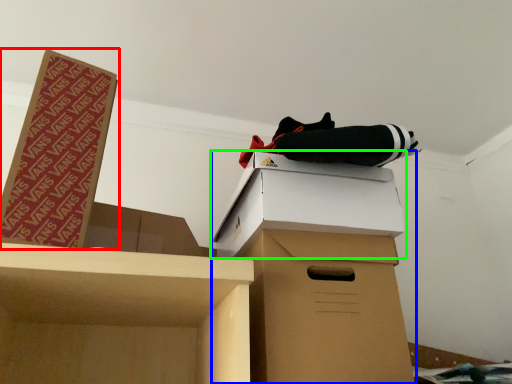
Question: Which object is the closest to the box (highlighted by a red box)? Choose among these: cardboard box (highlighted by a blue box) or box (highlighted by a green box).

Choices:
 (A) cardboard box
 (B) box

Answer: (B)